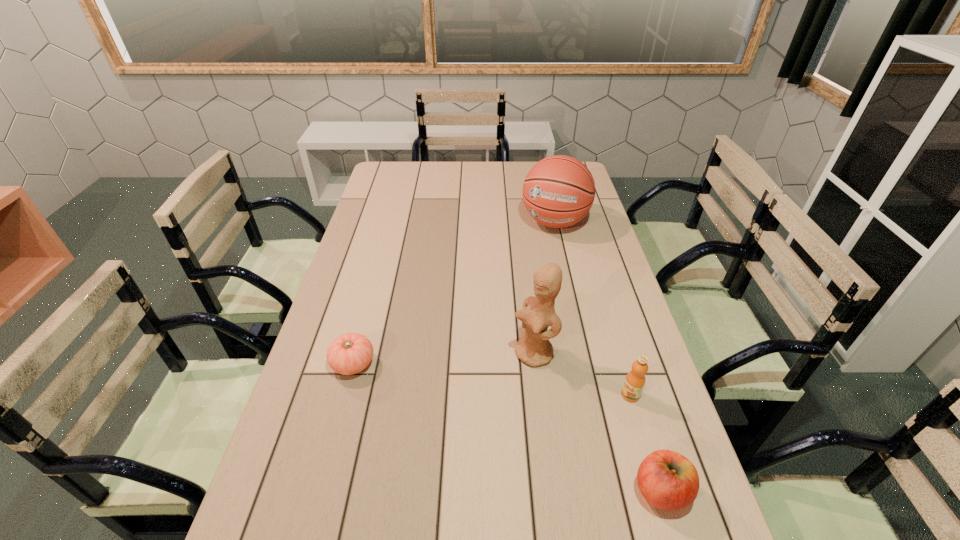
The image size is (960, 540). What are the coordinates of `free space on the desktop that is between the shortest object and the apple and is positioned on the front label of the second nearest object` in the screenshot? It's located at (533, 438).

You are a GUI agent. You are given a task and a screenshot of the screen. Output one action in this format:
    pyautogui.click(x=<x>, y=<y>)
    Task: Click on the vacant space on the desktop that is between the shortest object and the fourth tallest object and is positioned on the front-facing side of the figurine
    The image size is (960, 540).
    Given the screenshot: What is the action you would take?
    pyautogui.click(x=449, y=404)

This screenshot has height=540, width=960. What are the coordinates of `vacant spot on the desktop that is between the shortest object and the second shortest object and is positioned on the logo side of the farthest object` in the screenshot? It's located at (466, 410).